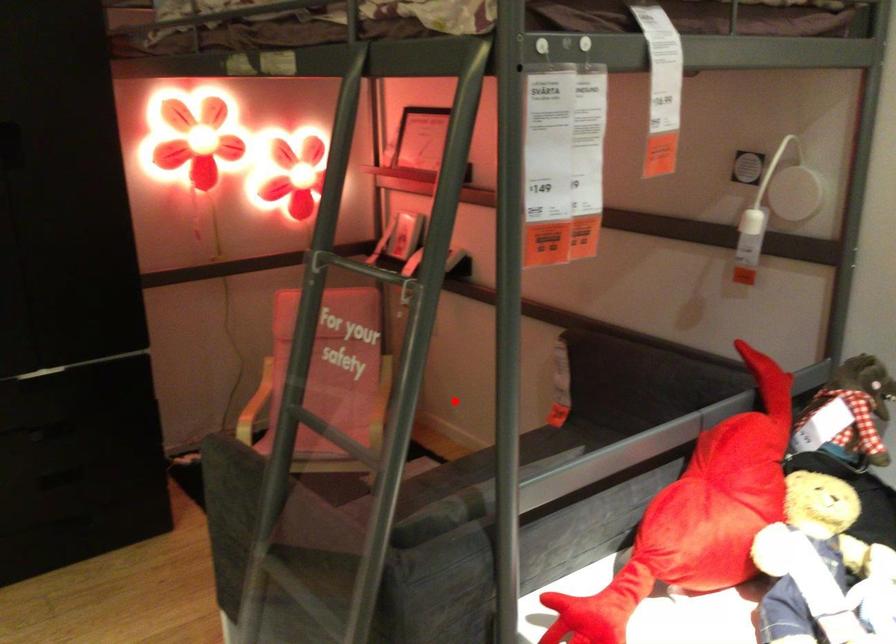
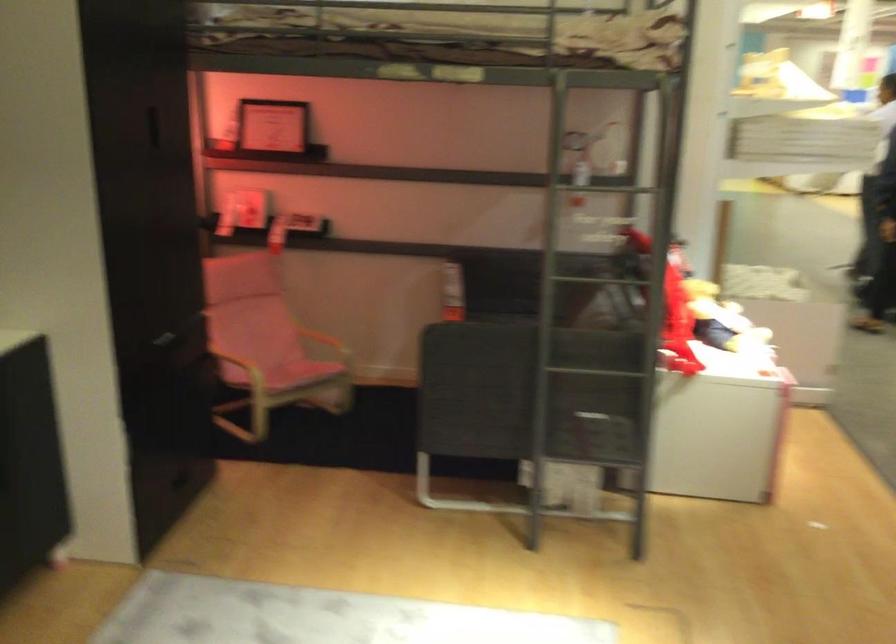
Question: I am providing you with two images of the same scene from different viewpoints. Image1 has a red point marked. In image2, the corresponding 3D location appears at what relative position? Reply with the corresponding letter.

Choices:
 (A) Closer
 (B) Farther

Answer: (B)